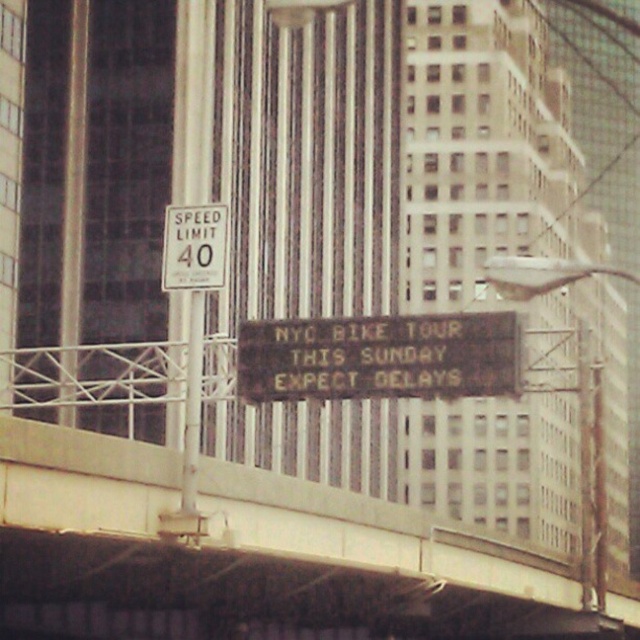
In the scene shown: You are a pedestrian standing on the sidewalk looking at the black plastic electronic display at center and the white plastic speed limit sign at upper center. Which object appears closer to you?

The black plastic electronic display at center appears closer because it is further to the viewer than the white plastic speed limit sign at upper center.

You are a pedestrian standing at the base of the pole holding both the black plastic electronic display at center and the white plastic speed limit sign at upper center. You want to touch both objects. Which object will require you to reach higher?

The white plastic speed limit sign at upper center is higher than the black plastic electronic display at center because it is positioned above it on the pole. To touch the white plastic speed limit sign at upper center, you would need to reach higher than for the black plastic electronic display at center.

You are a pedestrian standing on the sidewalk and see the black plastic electronic display at center and the white plastic speed limit sign at upper center. Which object is taller?

The black plastic electronic display at center is taller than the white plastic speed limit sign at upper center.